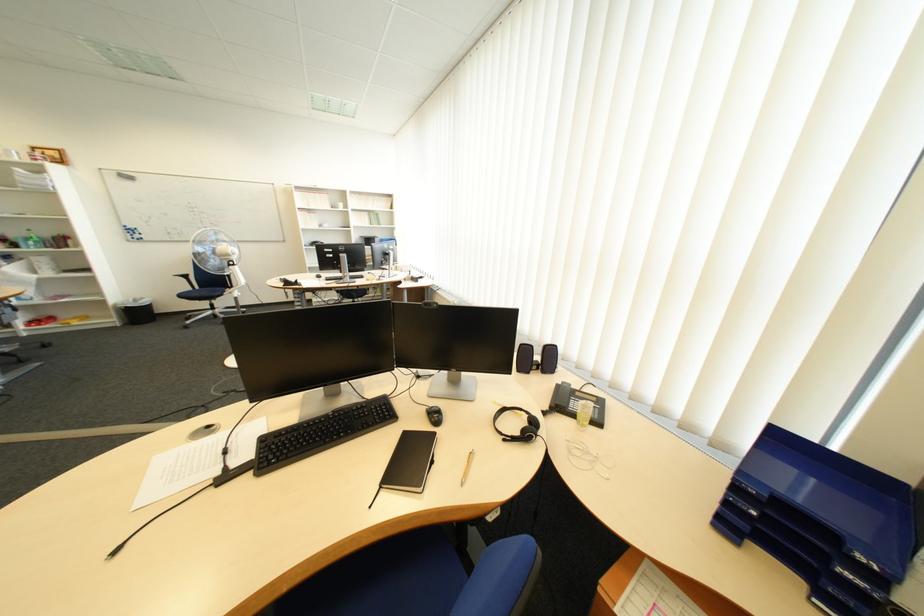
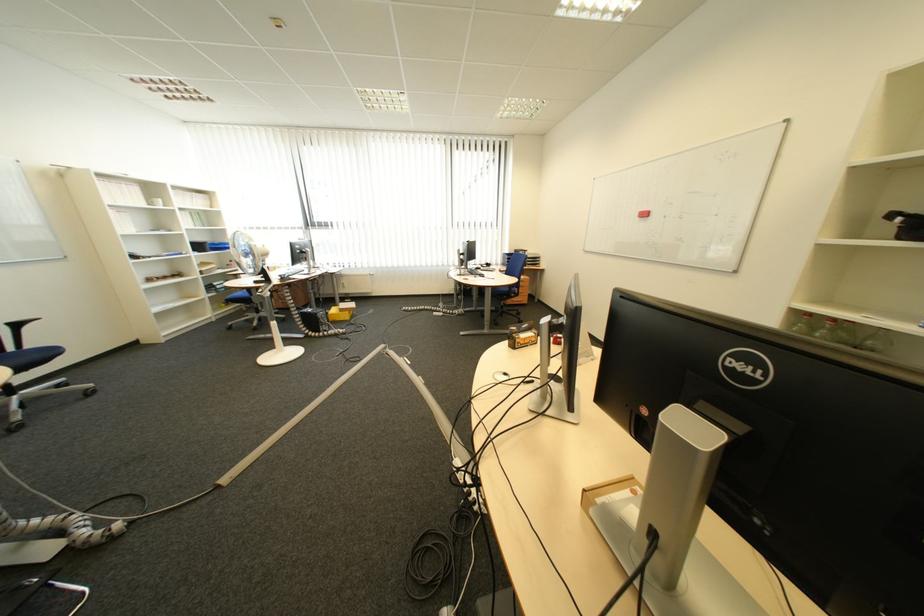
Question: I am providing you with two images of the same scene from different viewpoints. After the viewpoint changes to image2, which objects are now occluded?

Choices:
 (A) black chair armrest
 (B) glass bottle
 (C) blue chair surface
 (D) black headset

Answer: (D)